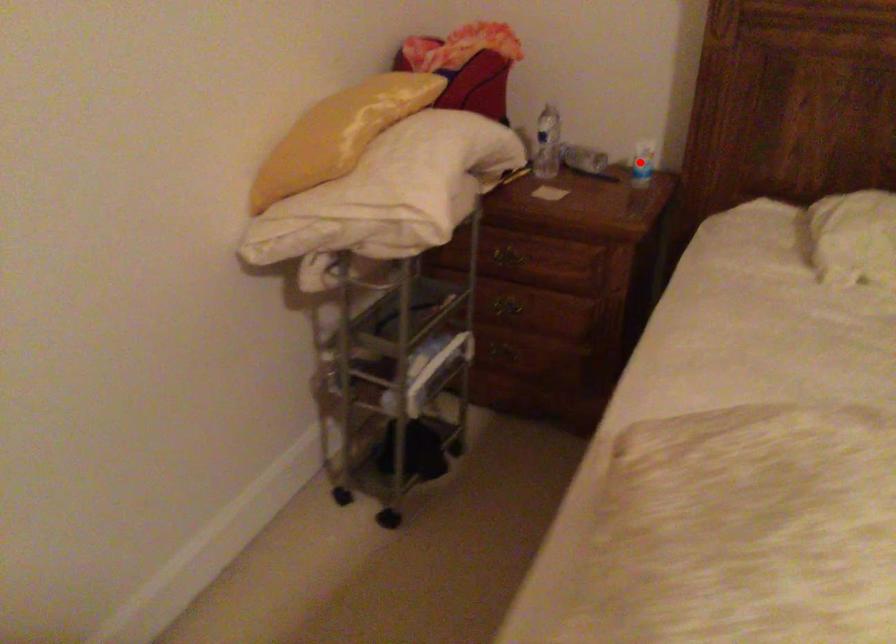
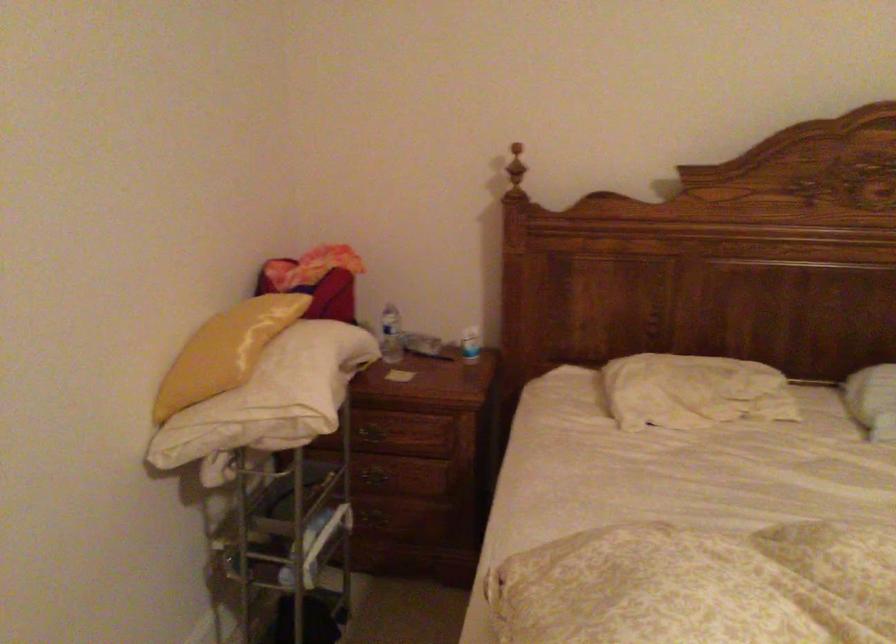
In the second image, find the point that corresponds to the highlighted location in the first image.

(470, 344)